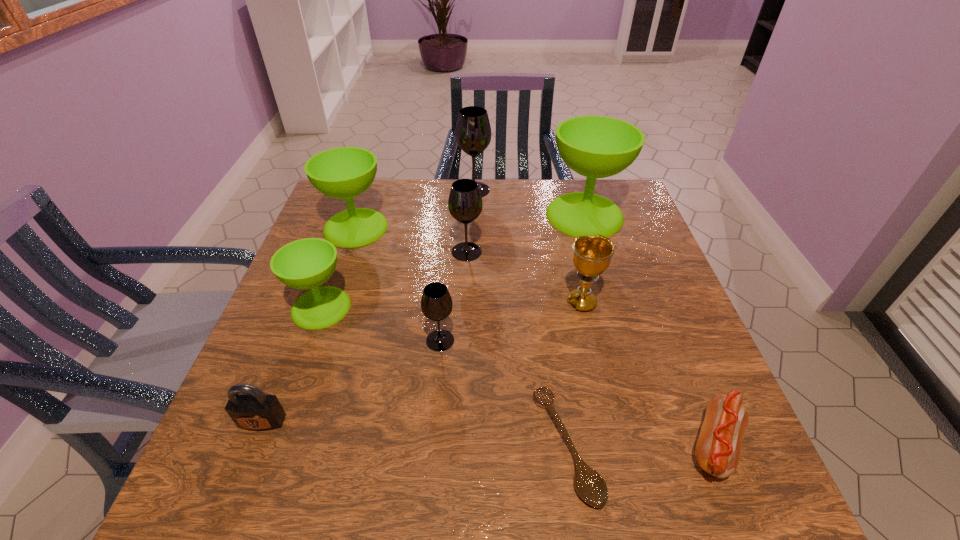
At what (x,y) coordinates should I click in order to perform the action: click on free space located 0.070m on the front of the gray padlock near the keyhole. Please return your answer as a coordinate pair (x, y). Image resolution: width=960 pixels, height=540 pixels. Looking at the image, I should click on (243, 471).

Locate an element on the screen. The width and height of the screenshot is (960, 540). free space located 0.170m on the back of the sausage is located at coordinates (672, 339).

Image resolution: width=960 pixels, height=540 pixels. In order to click on vacant position located on the left of the shortest object in this screenshot , I will do `click(414, 446)`.

I want to click on sausage present at the near edge, so click(718, 448).

Identify the location of ladle located at the near edge. (590, 486).

I want to click on padlock positioned at the left edge, so click(250, 408).

This screenshot has width=960, height=540. I want to click on wineglass present at the right edge, so (x=595, y=147).

The width and height of the screenshot is (960, 540). Find the location of `sausage situated at the right edge`. sausage situated at the right edge is located at coordinates [718, 448].

Find the location of a particular element. The width and height of the screenshot is (960, 540). object at the far left corner is located at coordinates (345, 172).

Where is `object located in the far right corner section of the desktop`? object located in the far right corner section of the desktop is located at coordinates (595, 147).